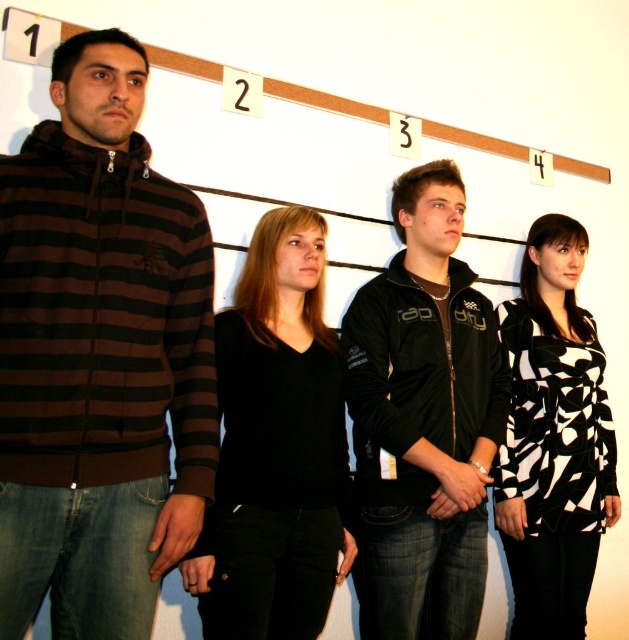
Question: Can you confirm if black matte sweater at center is smaller than black and white printed dress at center?

Choices:
 (A) yes
 (B) no

Answer: (A)

Question: Among these objects, which one is farthest from the camera?

Choices:
 (A) black matte sweater at center
 (B) brown striped hoodie at left
 (C) black matte jacket at center

Answer: (C)

Question: Does black matte sweater at center appear on the right side of black and white printed dress at center?

Choices:
 (A) no
 (B) yes

Answer: (A)

Question: Which point is farther to the camera?

Choices:
 (A) black and white printed dress at center
 (B) brown striped hoodie at left
 (C) black matte jacket at center
 (D) black matte sweater at center

Answer: (A)

Question: From the image, what is the correct spatial relationship of brown striped hoodie at left in relation to black matte sweater at center?

Choices:
 (A) above
 (B) below

Answer: (A)

Question: Among these points, which one is nearest to the camera?

Choices:
 (A) (513, 556)
 (B) (364, 298)

Answer: (B)